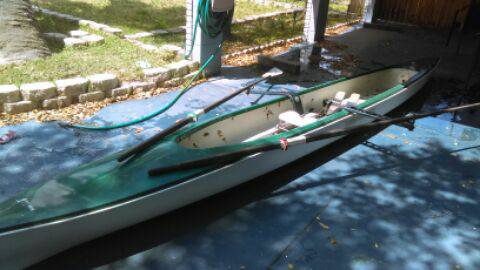
Locate an element on the screen. This screenshot has width=480, height=270. footrest is located at coordinates (332, 93), (354, 98).